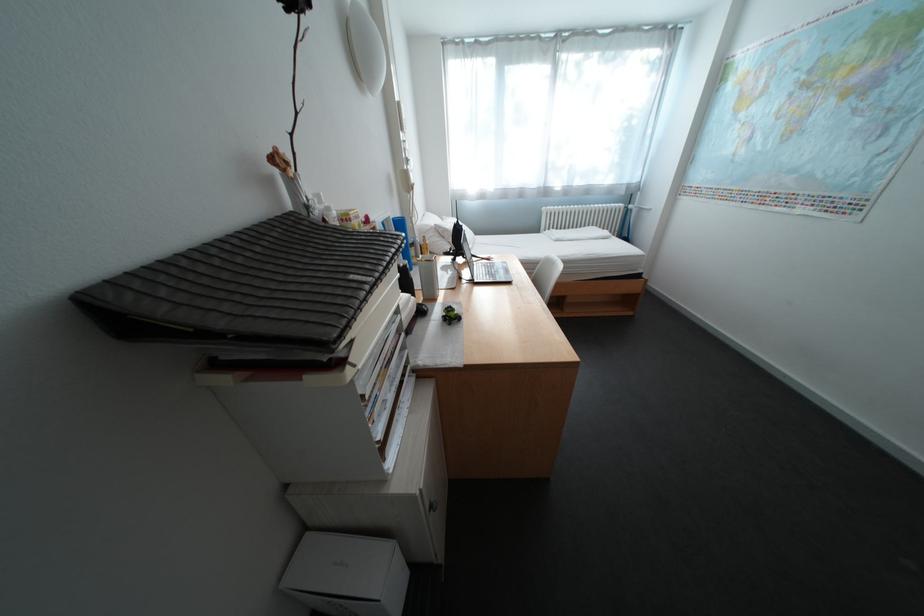
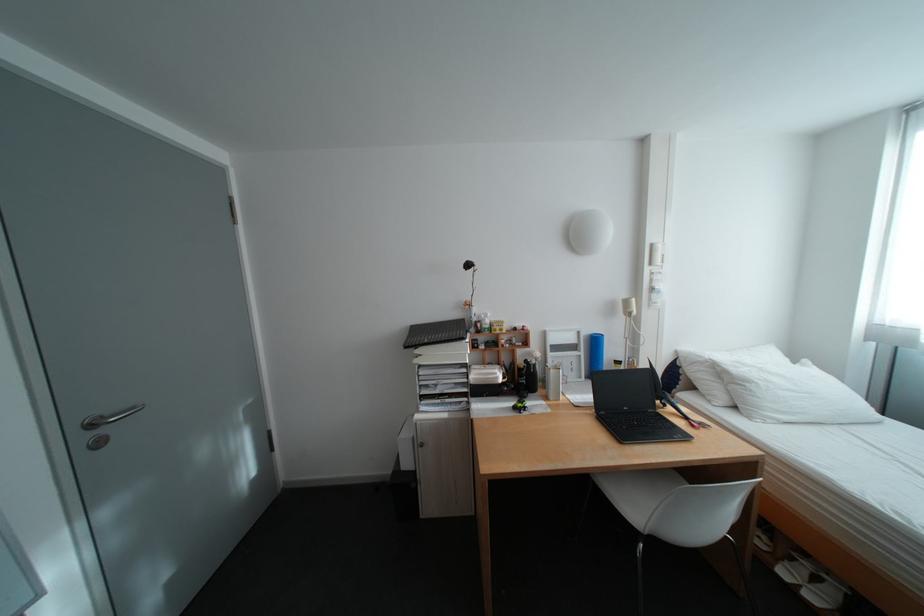
In the second image, find the point that corresponds to point (411, 105) in the first image.

(664, 246)